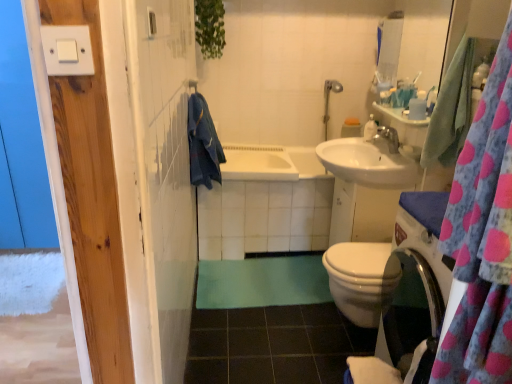
This screenshot has width=512, height=384. Find the location of `blank space situated above green rubber mat at lower center (from a real-world perspective)`. blank space situated above green rubber mat at lower center (from a real-world perspective) is located at coordinates (266, 308).